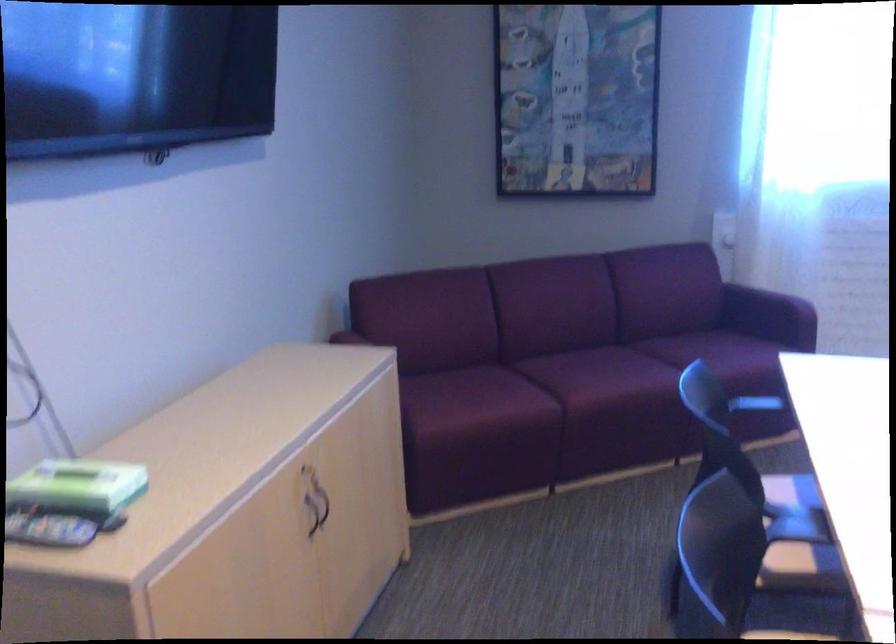
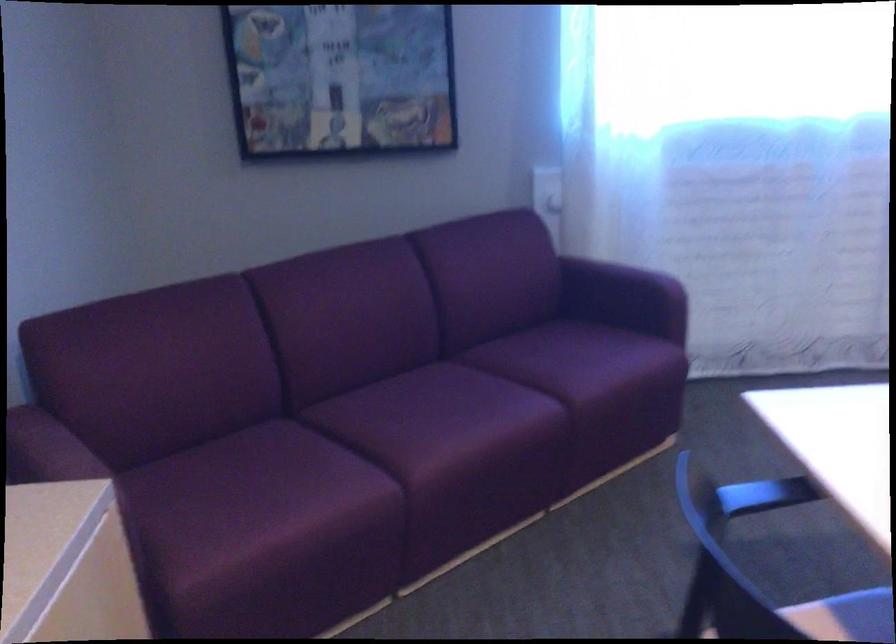
Locate, in the second image, the point that corresponds to pixel 600 377 in the first image.

(445, 422)